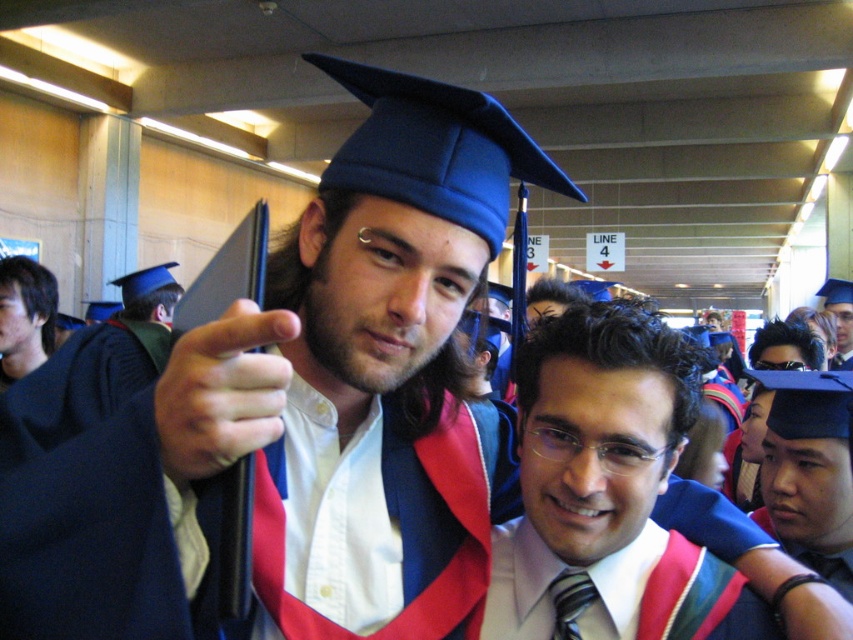
Question: Can you confirm if matte black hand at center is positioned to the left of matte blue graduation cap at upper center?

Choices:
 (A) yes
 (B) no

Answer: (A)

Question: Which object is closer to the camera taking this photo?

Choices:
 (A) matte blue graduation cap at upper center
 (B) matte white shirt at center
 (C) matte black graduation gown at left
 (D) matte blue graduation cap at center

Answer: (B)

Question: Is matte blue graduation cap at center below silky blue tie at center?

Choices:
 (A) yes
 (B) no

Answer: (B)

Question: Which point is farther to the camera?

Choices:
 (A) matte blue graduation cap at center
 (B) smooth black hair at left
 (C) matte black graduation gown at left

Answer: (C)

Question: Does matte blue graduation cap at center appear on the right side of matte blue graduation cap at upper center?

Choices:
 (A) yes
 (B) no

Answer: (B)

Question: Which point appears farthest from the camera in this image?

Choices:
 (A) (630, 413)
 (B) (834, 310)
 (C) (167, 305)

Answer: (B)